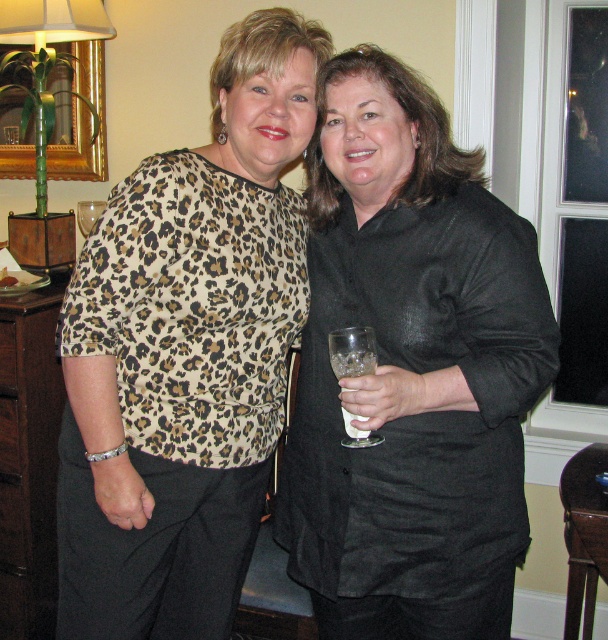
You are at a party and want to hand a small note to the woman wearing the black satin blouse at center without disturbing the clear glass wine glass at right she is holding. Which side of the woman should you approach to avoid her wine glass?

You should approach the left side of the woman wearing the black satin blouse at center because the clear glass wine glass at right is on her right side, so approaching from the left would avoid the wine glass.

You are standing in the room where the two women are. You want to reach a point that is exactly 1.16 meters away from you. Can you reach the point at coordinates point (371, 358)?

The point (371, 358) is 1.16 meters from viewer, so yes, you can reach the point at coordinates point (371, 358) since it is exactly 1.16 meters away.

You are a photographer at the event and need to ensure the black satin blouse at center and the clear glass wine glass at right are both visible in the photo. Which object should you focus on first to ensure both are in frame?

The black satin blouse at center is taller than the clear glass wine glass at right, so you should focus on the black satin blouse at center first to ensure both are in frame.